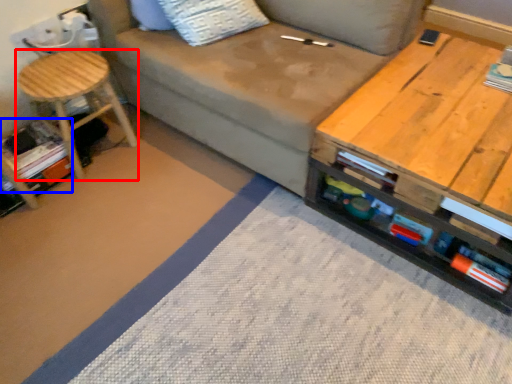
Question: Among these objects, which one is farthest to the camera, stool (highlighted by a red box) or book (highlighted by a blue box)?

Choices:
 (A) stool
 (B) book

Answer: (B)